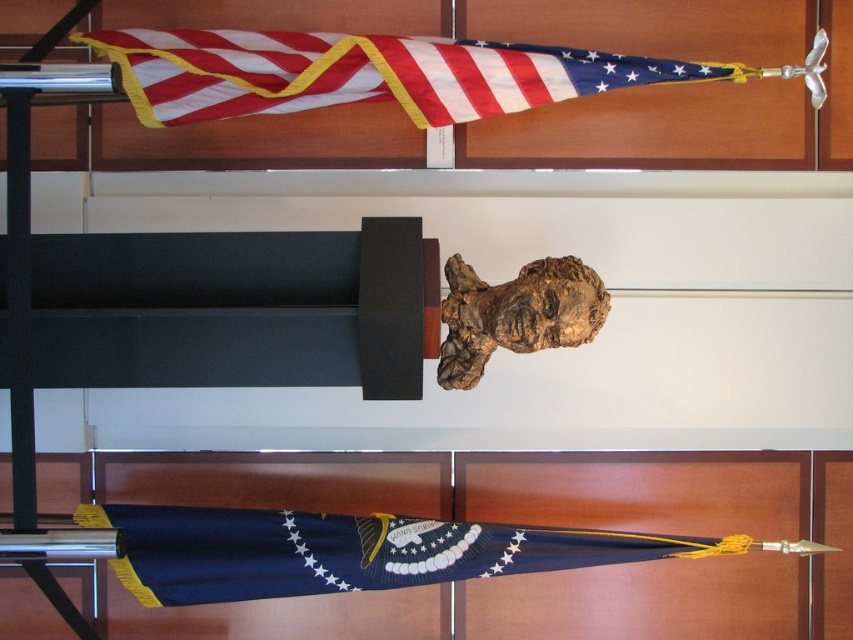
Question: Where is american flag at upper center located in relation to navy blue fabric at lower center in the image?

Choices:
 (A) left
 (B) right

Answer: (A)

Question: Which object is farther from the camera taking this photo?

Choices:
 (A) navy blue fabric at lower center
 (B) american flag at upper center

Answer: (A)

Question: Which point is closer to the camera?

Choices:
 (A) (413, 547)
 (B) (141, 102)

Answer: (B)

Question: Can you confirm if american flag at upper center is positioned below navy blue fabric at lower center?

Choices:
 (A) no
 (B) yes

Answer: (A)

Question: Is american flag at upper center above navy blue fabric at lower center?

Choices:
 (A) yes
 (B) no

Answer: (A)